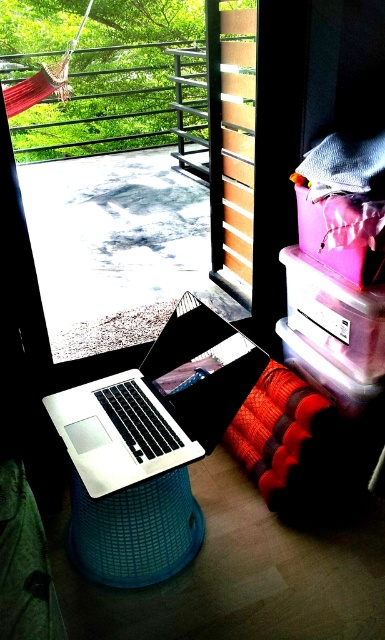
Question: Among these points, which one is nearest to the camera?

Choices:
 (A) (90, 336)
 (B) (214, 400)

Answer: (B)

Question: Which point appears farthest from the camera in this image?

Choices:
 (A) (78, 445)
 (B) (236, 273)

Answer: (B)

Question: Can you confirm if transparent glass door at upper center is bigger than silver metallic laptop at center?

Choices:
 (A) no
 (B) yes

Answer: (B)

Question: Is transparent glass door at upper center below silver metallic laptop at center?

Choices:
 (A) yes
 (B) no

Answer: (B)

Question: Can you confirm if transparent glass door at upper center is wider than silver metallic laptop at center?

Choices:
 (A) yes
 (B) no

Answer: (A)